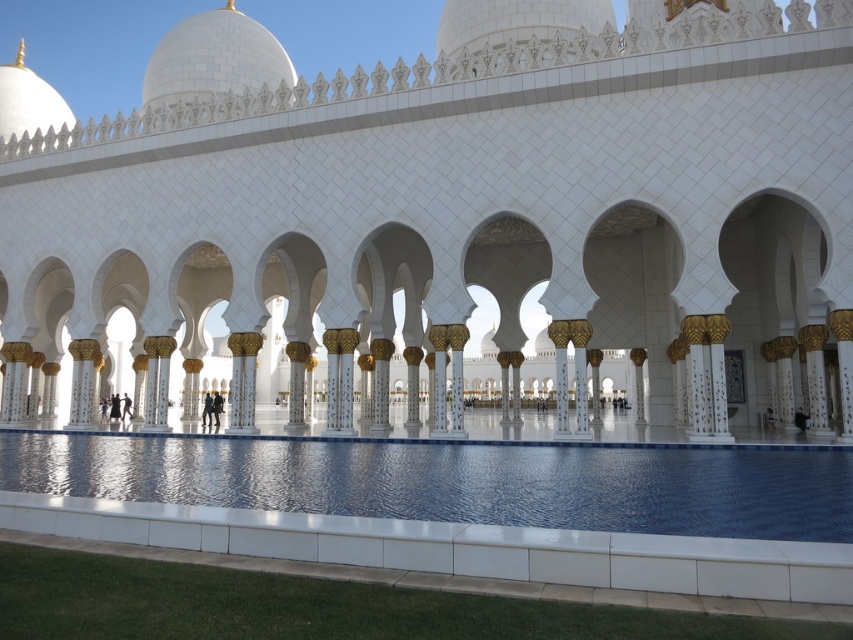
Question: Estimate the real-world distances between objects in this image. Which object is closer to the blue glossy water at center?

Choices:
 (A) white marble palace at center
 (B) white marble dome at upper center

Answer: (A)

Question: Does white marble palace at center have a larger size compared to blue glossy water at center?

Choices:
 (A) no
 (B) yes

Answer: (B)

Question: From the image, what is the correct spatial relationship of white marble palace at center in relation to blue glossy water at center?

Choices:
 (A) left
 (B) right

Answer: (A)

Question: Does white marble palace at center appear under blue glossy water at center?

Choices:
 (A) yes
 (B) no

Answer: (B)

Question: Which point appears farthest from the camera in this image?

Choices:
 (A) (340, 259)
 (B) (695, 520)

Answer: (A)

Question: Based on their relative distances, which object is nearer to the white marble palace at center?

Choices:
 (A) blue glossy water at center
 (B) white marble dome at upper center

Answer: (A)